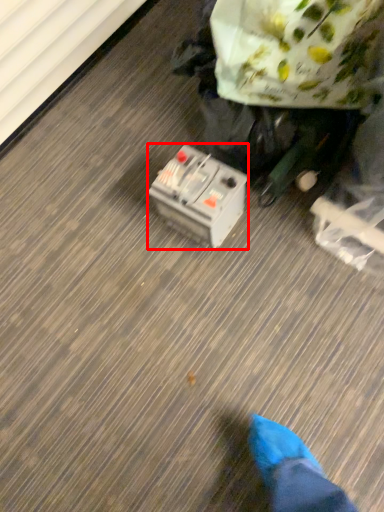
Question: From the image's perspective, what is the correct spatial relationship of equipment (annotated by the red box) in relation to paper bag?

Choices:
 (A) below
 (B) above

Answer: (A)